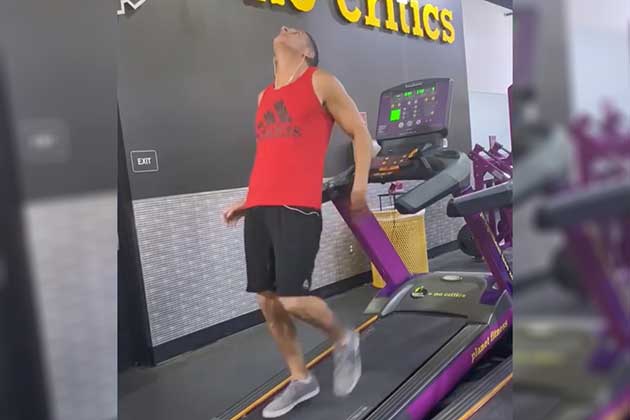
This screenshot has height=420, width=630. In order to click on treadmill in this screenshot , I will do `click(382, 382)`.